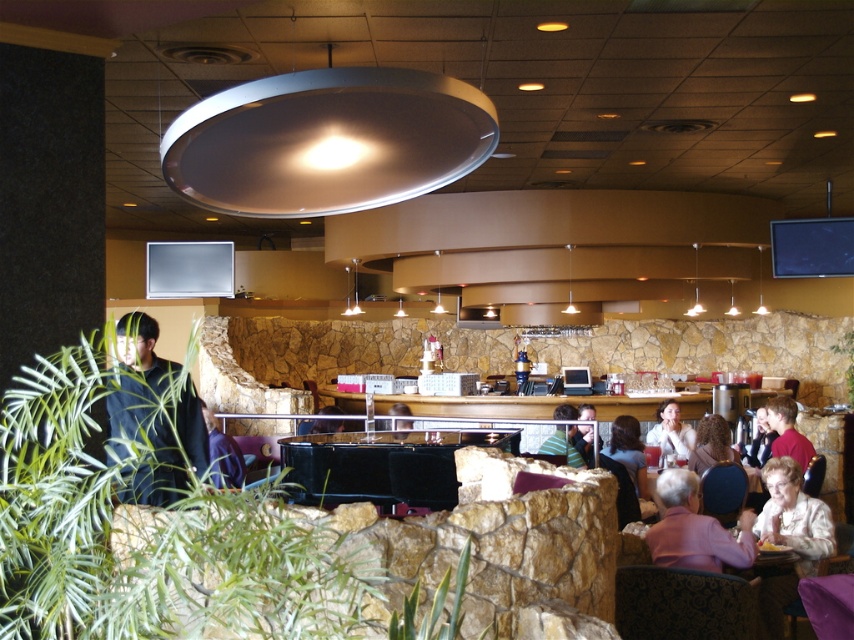
Does light beige sweater at lower right have a greater height compared to blurred hair at center?

No, light beige sweater at lower right is not taller than blurred hair at center.

Who is more forward, (667, 451) or (741, 451)?

Point (741, 451) is more forward.

Find the location of a particular element. The width and height of the screenshot is (854, 640). light beige sweater at lower right is located at coordinates (671, 433).

Can you confirm if light beige fabric at lower right is thinner than blurred hair at center?

No, light beige fabric at lower right is not thinner than blurred hair at center.

Is point (796, 504) behind point (759, 417)?

That is False.

Image resolution: width=854 pixels, height=640 pixels. What do you see at coordinates (794, 515) in the screenshot? I see `light beige fabric at lower right` at bounding box center [794, 515].

Where is `light beige fabric at lower right`? light beige fabric at lower right is located at coordinates (x=794, y=515).

Between point (784, 484) and point (636, 461), which one is positioned behind?

Positioned behind is point (636, 461).

Does light beige fabric at lower right have a lesser height compared to dark brown hair at center?

No, light beige fabric at lower right is not shorter than dark brown hair at center.

Which is in front, point (797, 538) or point (638, 436)?

Point (797, 538)

Identify the location of light beige fabric at lower right. The width and height of the screenshot is (854, 640). (794, 515).